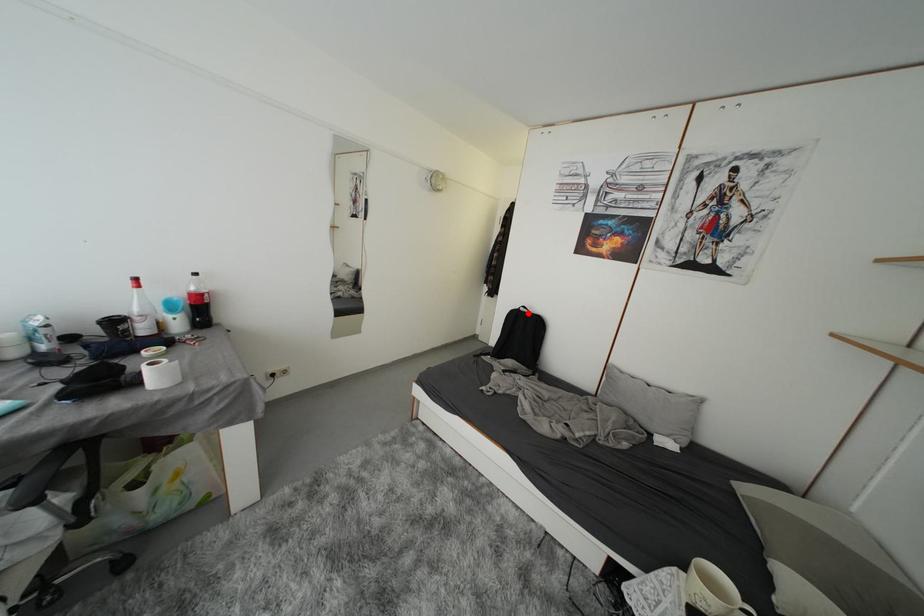
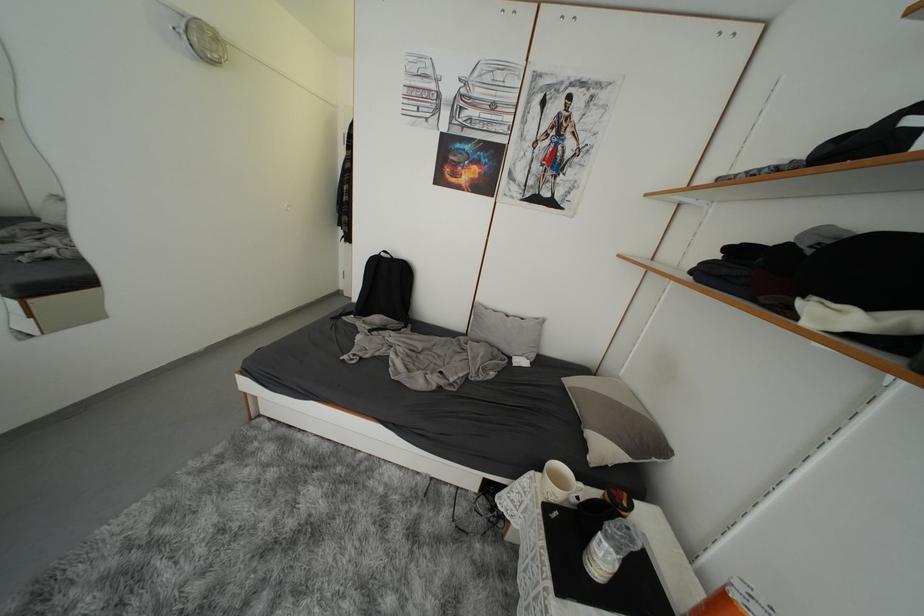
Locate, in the second image, the point that corresponds to the highlighted location in the first image.

(390, 257)